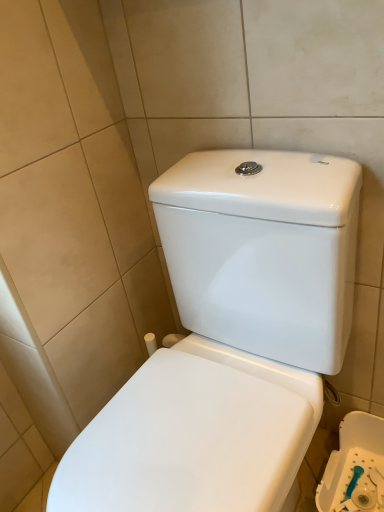
What do you see at coordinates (355, 467) in the screenshot? The image size is (384, 512). I see `white glossy toilet at lower right` at bounding box center [355, 467].

In order to click on white glossy toilet at lower right in this screenshot , I will do `click(355, 467)`.

The height and width of the screenshot is (512, 384). I want to click on white glossy toilet at center, so click(x=230, y=339).

What is the approximate height of white glossy toilet at center?

It is 31.68 inches.

Describe the element at coordinates (230, 339) in the screenshot. I see `white glossy toilet at center` at that location.

The height and width of the screenshot is (512, 384). Identify the location of white glossy toilet at lower right. (355, 467).

Consider the image. Considering the relative positions of white glossy toilet at center and white glossy toilet at lower right in the image provided, is white glossy toilet at center to the left of white glossy toilet at lower right from the viewer's perspective?

Correct, you'll find white glossy toilet at center to the left of white glossy toilet at lower right.

Which object is further away from the camera, white glossy toilet at center or white glossy toilet at lower right?

white glossy toilet at lower right is further away from the camera.

Does point (282, 484) come behind point (356, 481)?

No, it is in front of (356, 481).

Consider the image. From the image's perspective, is white glossy toilet at center beneath white glossy toilet at lower right?

Actually, white glossy toilet at center appears above white glossy toilet at lower right in the image.

From a real-world perspective, which is physically below, white glossy toilet at center or white glossy toilet at lower right?

white glossy toilet at lower right, from a real-world perspective.

Can you confirm if white glossy toilet at center is thinner than white glossy toilet at lower right?

No.

Considering the sizes of objects white glossy toilet at center and white glossy toilet at lower right in the image provided, who is taller, white glossy toilet at center or white glossy toilet at lower right?

With more height is white glossy toilet at center.

Is white glossy toilet at center smaller than white glossy toilet at lower right?

No.

Is white glossy toilet at lower right located within white glossy toilet at center?

No, white glossy toilet at lower right is not inside white glossy toilet at center.

In the scene shown: Is white glossy toilet at center touching white glossy toilet at lower right?

There is a gap between white glossy toilet at center and white glossy toilet at lower right.

Is white glossy toilet at lower right at the back of white glossy toilet at center?

No, white glossy toilet at lower right is not at the back of white glossy toilet at center.

Measure the distance between white glossy toilet at center and white glossy toilet at lower right.

white glossy toilet at center is 18.75 inches away from white glossy toilet at lower right.

At what (x,y) coordinates should I click in order to perform the action: click on toilet located in front of the white glossy toilet at lower right. Please return your answer as a coordinate pair (x, y). Looking at the image, I should click on (230, 339).

Considering the positions of objects white glossy toilet at lower right and white glossy toilet at center in the image provided, who is more to the left, white glossy toilet at lower right or white glossy toilet at center?

Positioned to the left is white glossy toilet at center.

Based on the photo, does white glossy toilet at lower right lie in front of white glossy toilet at center?

No, it is behind white glossy toilet at center.

Does point (323, 475) come closer to viewer compared to point (147, 381)?

That is False.

From the image's perspective, is white glossy toilet at lower right positioned above or below white glossy toilet at center?

white glossy toilet at lower right is below white glossy toilet at center.

From a real-world perspective, is white glossy toilet at lower right above or below white glossy toilet at center?

Clearly, from a real-world perspective, white glossy toilet at lower right is below white glossy toilet at center.

Is white glossy toilet at lower right thinner than white glossy toilet at center?

Correct, the width of white glossy toilet at lower right is less than that of white glossy toilet at center.

Who is shorter, white glossy toilet at lower right or white glossy toilet at center?

With less height is white glossy toilet at lower right.

Does white glossy toilet at lower right have a smaller size compared to white glossy toilet at center?

Answer: Correct, white glossy toilet at lower right occupies less space than white glossy toilet at center.

Is white glossy toilet at lower right inside or outside of white glossy toilet at center?

The correct answer is: outside.

Is white glossy toilet at lower right positioned far away from white glossy toilet at center?

No.

Is white glossy toilet at lower right facing away from white glossy toilet at center?

white glossy toilet at lower right is not turned away from white glossy toilet at center.

Where is `toilet above the white glossy toilet at lower right (from the image's perspective)`? This screenshot has width=384, height=512. toilet above the white glossy toilet at lower right (from the image's perspective) is located at coordinates (230, 339).

Find the location of a particular element. This screenshot has height=512, width=384. toilet that appears above the white glossy toilet at lower right (from the image's perspective) is located at coordinates (230, 339).

The width and height of the screenshot is (384, 512). Find the location of `porcelain behind the white glossy toilet at center`. porcelain behind the white glossy toilet at center is located at coordinates [x=355, y=467].